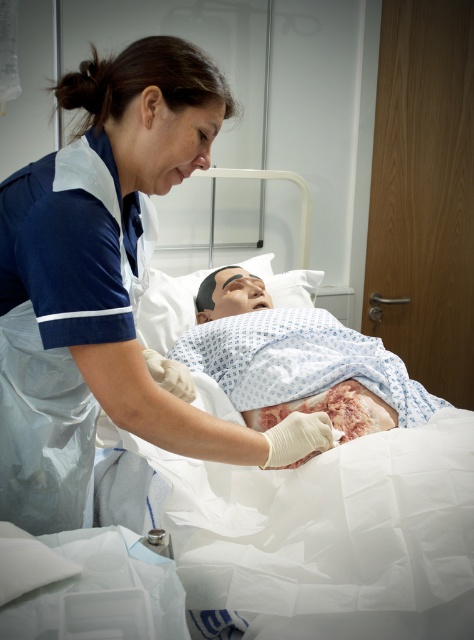
Is blue uniform at center shorter than scarred skin at center?

Incorrect, blue uniform at center's height does not fall short of scarred skin at center's.

Image resolution: width=474 pixels, height=640 pixels. Find the location of `blue uniform at center`. blue uniform at center is located at coordinates (106, 285).